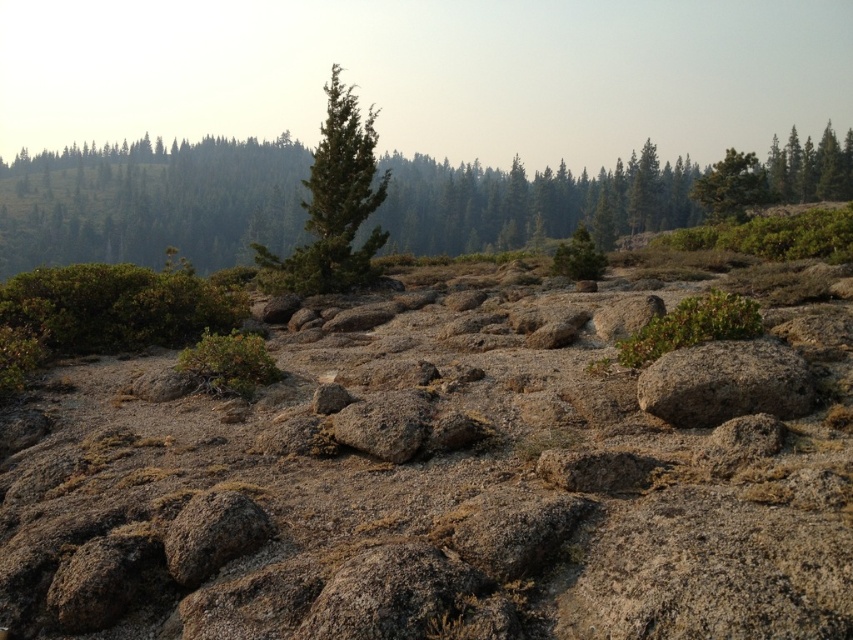
Between point (177, 237) and point (194, 512), which one is positioned in front?

Point (194, 512)

Which of these two, green textured pine trees at upper center or gray rough rock at center, stands shorter?

Standing shorter between the two is gray rough rock at center.

Between point (105, 173) and point (256, 524), which one is positioned in front?

Positioned in front is point (256, 524).

Where is `green textured pine trees at upper center`? This screenshot has height=640, width=853. green textured pine trees at upper center is located at coordinates (151, 204).

Is point (606, 321) positioned behind point (349, 250)?

No, (606, 321) is in front of (349, 250).

Can you confirm if dull gray rock at center is positioned to the left of green textured tree at center?

Incorrect, dull gray rock at center is not on the left side of green textured tree at center.

Which is in front, point (357, 506) or point (265, 259)?

Positioned in front is point (357, 506).

You are a GUI agent. You are given a task and a screenshot of the screen. Output one action in this format:
    pyautogui.click(x=<x>, y=<y>)
    Task: Click on the dull gray rock at center
    This screenshot has width=853, height=640.
    Given the screenshot: What is the action you would take?
    click(432, 483)

Measure the distance between green textured tree at center and green matte tree at center.

green textured tree at center is 85.53 feet from green matte tree at center.

Is green textured tree at center shorter than green matte tree at center?

In fact, green textured tree at center may be taller than green matte tree at center.

At what (x,y) coordinates should I click in order to perform the action: click on green textured tree at center. Please return your answer as a coordinate pair (x, y). This screenshot has height=640, width=853. Looking at the image, I should click on (334, 204).